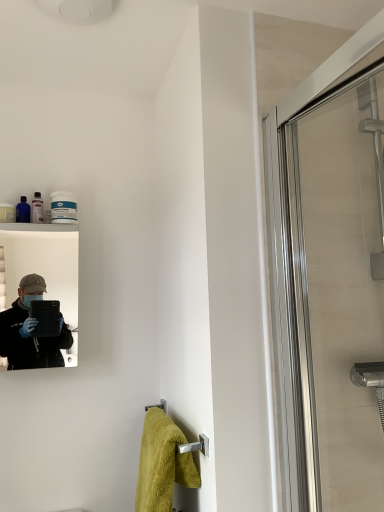
Identify the location of soft yellow towel at lower center. This screenshot has height=512, width=384. 162,463.

Locate an element on the screen. This screenshot has width=384, height=512. clear glass shower door at right is located at coordinates (329, 295).

Is matte black mirror at left placed right next to soft yellow towel at lower center?

No, matte black mirror at left is not touching soft yellow towel at lower center.

Could you tell me if matte black mirror at left is turned towards soft yellow towel at lower center?

No, matte black mirror at left is not oriented towards soft yellow towel at lower center.

Does matte black mirror at left have a smaller size compared to soft yellow towel at lower center?

Indeed, matte black mirror at left has a smaller size compared to soft yellow towel at lower center.

Measure the distance from clear glass shower door at right to matte black mirror at left.

The distance of clear glass shower door at right from matte black mirror at left is 34.34 inches.

Identify the location of screen door located in front of the matte black mirror at left. (329, 295).

Between clear glass shower door at right and matte black mirror at left, which one appears on the right side from the viewer's perspective?

From the viewer's perspective, clear glass shower door at right appears more on the right side.

Considering the points (288, 149) and (59, 289), which point is behind, point (288, 149) or point (59, 289)?

The point (59, 289) is farther.

In terms of size, does soft yellow towel at lower center appear bigger or smaller than clear glass shower door at right?

In the image, soft yellow towel at lower center appears to be smaller than clear glass shower door at right.

Who is taller, soft yellow towel at lower center or clear glass shower door at right?

With more height is clear glass shower door at right.

Is the surface of soft yellow towel at lower center in direct contact with clear glass shower door at right?

No, soft yellow towel at lower center is not in contact with clear glass shower door at right.

Looking at this image, is soft yellow towel at lower center to the right of clear glass shower door at right from the viewer's perspective?

No.

Is the surface of clear glass shower door at right in direct contact with soft yellow towel at lower center?

No.

Find the location of a particular element. This screenshot has width=384, height=512. bath towel to the left of clear glass shower door at right is located at coordinates (162, 463).

From the image's perspective, is clear glass shower door at right located above or below soft yellow towel at lower center?

Clearly, from the image's perspective, clear glass shower door at right is above soft yellow towel at lower center.

Can you confirm if soft yellow towel at lower center is bigger than matte black mirror at left?

Yes, soft yellow towel at lower center is bigger than matte black mirror at left.

Is soft yellow towel at lower center aimed at matte black mirror at left?

No, soft yellow towel at lower center is not oriented towards matte black mirror at left.

Is soft yellow towel at lower center spatially inside matte black mirror at left, or outside of it?

soft yellow towel at lower center is not inside matte black mirror at left, it's outside.

Which object is wider, matte black mirror at left or clear glass shower door at right?

With larger width is matte black mirror at left.

From the image's perspective, is matte black mirror at left on top of clear glass shower door at right?

Incorrect, from the image's perspective, matte black mirror at left is lower than clear glass shower door at right.

Is point (69, 317) closer to viewer compared to point (353, 323)?

No, (69, 317) is further to viewer.

I want to click on mirror above the soft yellow towel at lower center (from a real-world perspective), so click(x=38, y=291).

I want to click on screen door located on the right of matte black mirror at left, so click(x=329, y=295).

Which object lies further to the anchor point clear glass shower door at right, matte black mirror at left or soft yellow towel at lower center?

matte black mirror at left lies further to clear glass shower door at right than the other object.

Based on their spatial positions, is clear glass shower door at right or matte black mirror at left further from soft yellow towel at lower center?

matte black mirror at left lies further to soft yellow towel at lower center than the other object.

Looking at the image, which one is located further to soft yellow towel at lower center, matte black mirror at left or clear glass shower door at right?

matte black mirror at left.

From the picture: From the image, which object appears to be farther from matte black mirror at left, clear glass shower door at right or soft yellow towel at lower center?

clear glass shower door at right.

Consider the image. Looking at the image, which one is located further to clear glass shower door at right, soft yellow towel at lower center or matte black mirror at left?

matte black mirror at left is positioned further to the anchor clear glass shower door at right.

When comparing their distances from matte black mirror at left, does soft yellow towel at lower center or clear glass shower door at right seem further?

clear glass shower door at right.

Where is `bath towel between matte black mirror at left and clear glass shower door at right from left to right`? Image resolution: width=384 pixels, height=512 pixels. bath towel between matte black mirror at left and clear glass shower door at right from left to right is located at coordinates (162, 463).